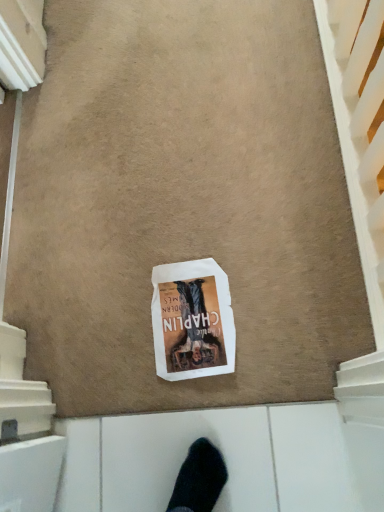
The width and height of the screenshot is (384, 512). I want to click on unoccupied space behind white paper bag at center, so click(x=159, y=233).